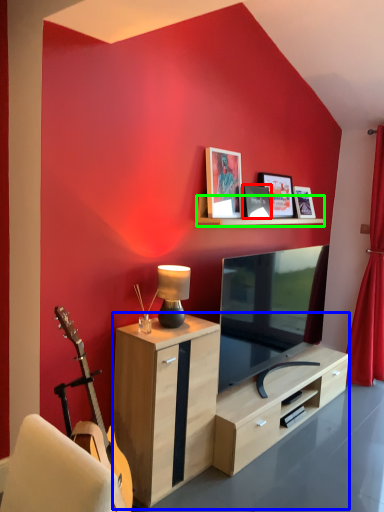
Question: Which is farther away from picture frame (highlighted by a red box)? desk (highlighted by a blue box) or shelf (highlighted by a green box)?

Choices:
 (A) desk
 (B) shelf

Answer: (A)